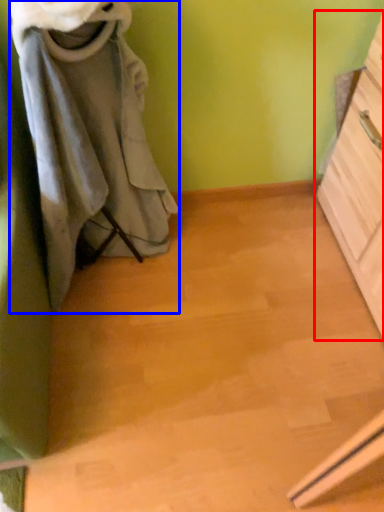
Question: Which point is further to the camera, chest of drawers (highlighted by a red box) or laundry (highlighted by a blue box)?

Choices:
 (A) chest of drawers
 (B) laundry

Answer: (A)